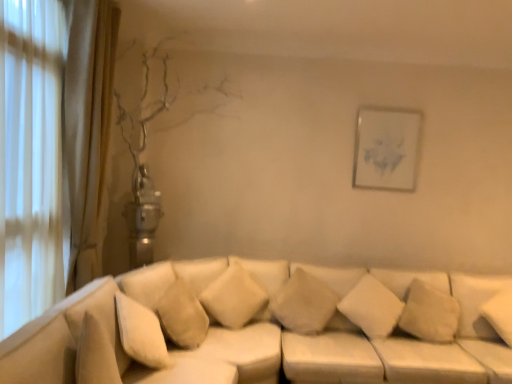
Question: Is white soft pillow at center, which is the 2th pillow in right-to-left order, directly adjacent to white soft cushion at center, which ranks as the first pillow in left-to-right order?

Choices:
 (A) no
 (B) yes

Answer: (A)

Question: Is white soft cushion at center, which ranks as the first pillow in left-to-right order, at the back of white soft pillow at center, positioned as the 3th pillow in left-to-right order?

Choices:
 (A) no
 (B) yes

Answer: (A)

Question: Is white soft pillow at center, which is the 2th pillow in right-to-left order, to the right of white soft cushion at center, the fourth pillow positioned from the right, from the viewer's perspective?

Choices:
 (A) yes
 (B) no

Answer: (A)

Question: Is white soft pillow at center, positioned as the 3th pillow in left-to-right order, outside of white soft cushion at center, which ranks as the first pillow in left-to-right order?

Choices:
 (A) no
 (B) yes

Answer: (B)

Question: From the image's perspective, does white soft pillow at center, which is the 2th pillow in right-to-left order, appear lower than white soft cushion at center, the fourth pillow positioned from the right?

Choices:
 (A) yes
 (B) no

Answer: (A)

Question: Considering the positions of white soft pillow at center, which is counted as the 3th pillow, starting from the right, and white soft cushion at center, which ranks as the first pillow in left-to-right order, in the image, is white soft pillow at center, which is counted as the 3th pillow, starting from the right, taller or shorter than white soft cushion at center, which ranks as the first pillow in left-to-right order,?

Choices:
 (A) short
 (B) tall

Answer: (A)

Question: Considering their positions, is white soft pillow at center, which is counted as the 2th pillow, starting from the left, located in front of or behind white soft cushion at center, the fourth pillow positioned from the right?

Choices:
 (A) front
 (B) behind

Answer: (B)

Question: Looking at their shapes, would you say white soft pillow at center, which is counted as the 2th pillow, starting from the left, is wider or thinner than white soft cushion at center, which ranks as the first pillow in left-to-right order?

Choices:
 (A) wide
 (B) thin

Answer: (A)

Question: In the image, is white soft pillow at center, which is counted as the 3th pillow, starting from the right, on the left side or the right side of white soft cushion at center, the fourth pillow positioned from the right?

Choices:
 (A) left
 (B) right

Answer: (B)

Question: Is white soft cushion at center, the fourth pillow positioned from the right, wider or thinner than white soft pillow at center, which is counted as the 2th pillow, starting from the left?

Choices:
 (A) thin
 (B) wide

Answer: (A)

Question: Is white soft cushion at center, the fourth pillow positioned from the right, bigger or smaller than white soft pillow at center, which is counted as the 2th pillow, starting from the left?

Choices:
 (A) small
 (B) big

Answer: (A)

Question: Relative to white soft pillow at center, which is counted as the 3th pillow, starting from the right, is white soft cushion at center, which ranks as the first pillow in left-to-right order, in front or behind?

Choices:
 (A) behind
 (B) front

Answer: (B)

Question: In the image, is white soft cushion at center, which ranks as the first pillow in left-to-right order, on the left side or the right side of white soft pillow at center, which is counted as the 2th pillow, starting from the left?

Choices:
 (A) right
 (B) left

Answer: (B)

Question: Considering the positions of white paper at upper right and white soft cushion at center, the fourth pillow positioned from the right, in the image, is white paper at upper right taller or shorter than white soft cushion at center, the fourth pillow positioned from the right,?

Choices:
 (A) tall
 (B) short

Answer: (A)

Question: Is white paper at upper right wider or thinner than white soft cushion at center, the fourth pillow positioned from the right?

Choices:
 (A) wide
 (B) thin

Answer: (B)